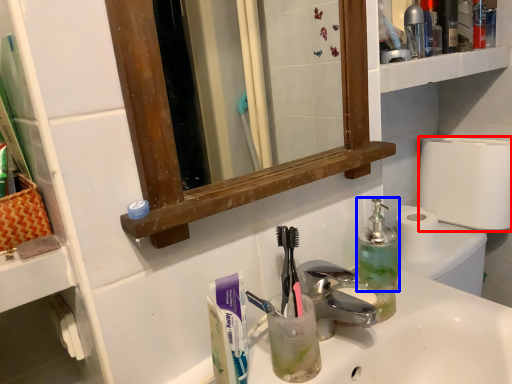
Question: Which object appears farthest to the camera in this image, toilet roll (highlighted by a red box) or bottle (highlighted by a blue box)?

Choices:
 (A) toilet roll
 (B) bottle

Answer: (A)